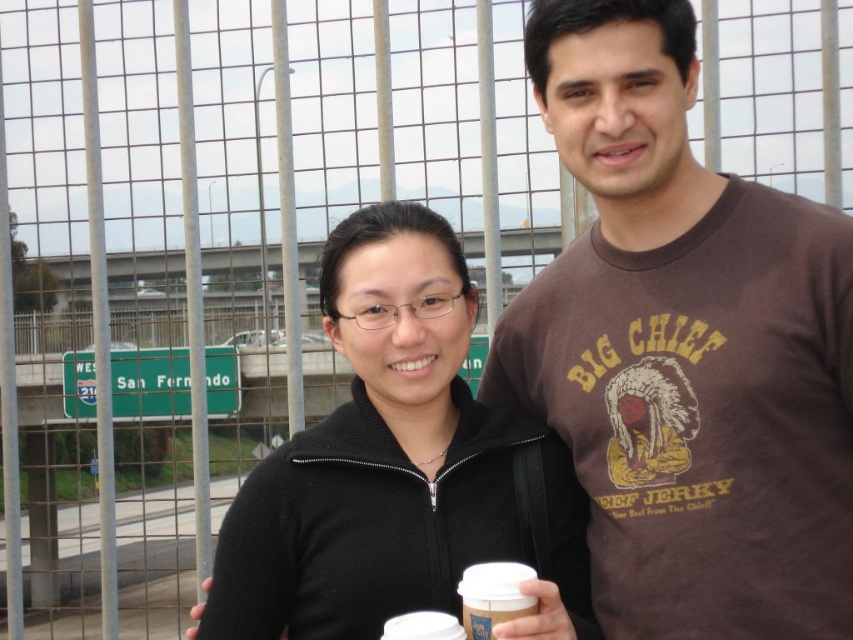
Question: Can you confirm if brown cotton t-shirt at center is thinner than black matte jacket at center?

Choices:
 (A) yes
 (B) no

Answer: (A)

Question: Does black matte jacket at center have a larger size compared to white paper cup at center?

Choices:
 (A) yes
 (B) no

Answer: (A)

Question: Which object is the farthest from the brown cotton t-shirt at center?

Choices:
 (A) white paper cup at lower center
 (B) black matte jacket at center

Answer: (A)

Question: Does black matte jacket at center appear on the left side of white paper cup at lower center?

Choices:
 (A) yes
 (B) no

Answer: (A)

Question: Which object appears farthest from the camera in this image?

Choices:
 (A) white paper cup at center
 (B) white paper cup at lower center
 (C) black matte jacket at center

Answer: (C)

Question: Which point is farther to the camera?

Choices:
 (A) black matte jacket at center
 (B) white paper cup at center
 (C) brown cotton t-shirt at center
 (D) white paper cup at lower center

Answer: (A)